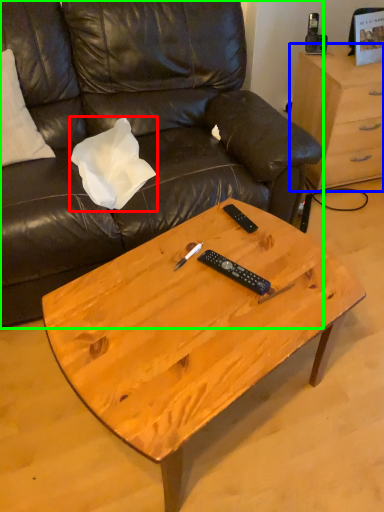
Question: Which is nearer to the pillow (highlighted by a red box)? desk (highlighted by a blue box) or studio couch (highlighted by a green box).

Choices:
 (A) desk
 (B) studio couch

Answer: (B)